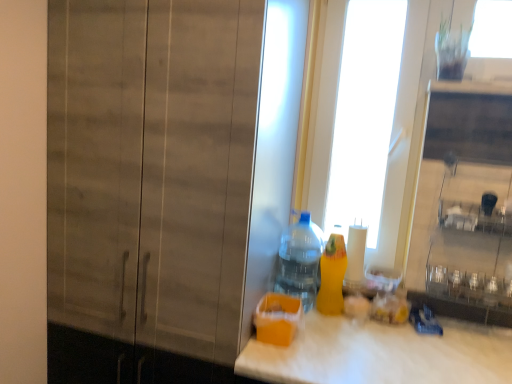
Question: Can you confirm if translucent plastic bottle at center, the 2th bottle from the right, is thinner than transparent glass door at upper center?

Choices:
 (A) no
 (B) yes

Answer: (A)

Question: From the image's perspective, does translucent plastic bottle at center, the 1th bottle positioned from the left, appear higher than transparent glass door at upper center?

Choices:
 (A) yes
 (B) no

Answer: (B)

Question: Is translucent plastic bottle at center, the 2th bottle from the right, positioned beyond the bounds of transparent glass door at upper center?

Choices:
 (A) no
 (B) yes

Answer: (B)

Question: Is translucent plastic bottle at center, the 1th bottle positioned from the left, positioned before transparent glass door at upper center?

Choices:
 (A) no
 (B) yes

Answer: (B)

Question: Is translucent plastic bottle at center, the 1th bottle positioned from the left, shorter than transparent glass door at upper center?

Choices:
 (A) no
 (B) yes

Answer: (B)

Question: From a real-world perspective, is wooden cabinet at left physically located above or below yellow matte bottle at right, the first bottle viewed from the right?

Choices:
 (A) above
 (B) below

Answer: (A)

Question: Visually, is wooden cabinet at left positioned to the left or to the right of yellow matte bottle at right, marked as the 2th bottle in a left-to-right arrangement?

Choices:
 (A) left
 (B) right

Answer: (A)

Question: Considering the positions of wooden cabinet at left and yellow matte bottle at right, marked as the 2th bottle in a left-to-right arrangement, in the image, is wooden cabinet at left wider or thinner than yellow matte bottle at right, marked as the 2th bottle in a left-to-right arrangement,?

Choices:
 (A) wide
 (B) thin

Answer: (A)

Question: Is wooden cabinet at left taller or shorter than yellow matte bottle at right, marked as the 2th bottle in a left-to-right arrangement?

Choices:
 (A) short
 (B) tall

Answer: (B)

Question: Is wooden cabinet at left in front of or behind transparent glass door at upper center in the image?

Choices:
 (A) front
 (B) behind

Answer: (A)

Question: Do you think wooden cabinet at left is within transparent glass door at upper center, or outside of it?

Choices:
 (A) outside
 (B) inside

Answer: (A)

Question: Looking at their shapes, would you say wooden cabinet at left is wider or thinner than transparent glass door at upper center?

Choices:
 (A) thin
 (B) wide

Answer: (B)

Question: In the image, is wooden cabinet at left on the left side or the right side of transparent glass door at upper center?

Choices:
 (A) left
 (B) right

Answer: (A)

Question: Is translucent plastic bottle at center, the 2th bottle from the right, bigger or smaller than yellow matte bottle at right, the first bottle viewed from the right?

Choices:
 (A) small
 (B) big

Answer: (B)

Question: Considering the positions of translucent plastic bottle at center, the 2th bottle from the right, and yellow matte bottle at right, marked as the 2th bottle in a left-to-right arrangement, in the image, is translucent plastic bottle at center, the 2th bottle from the right, taller or shorter than yellow matte bottle at right, marked as the 2th bottle in a left-to-right arrangement,?

Choices:
 (A) short
 (B) tall

Answer: (B)